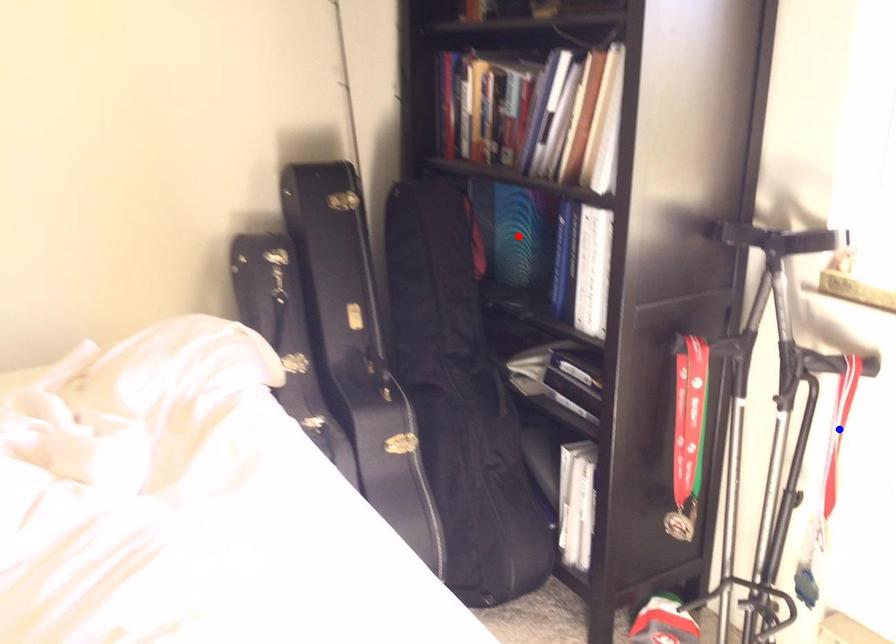
Question: Which of the two points in the image is closer to the camera?

Choices:
 (A) Blue point is closer.
 (B) Red point is closer.

Answer: (A)